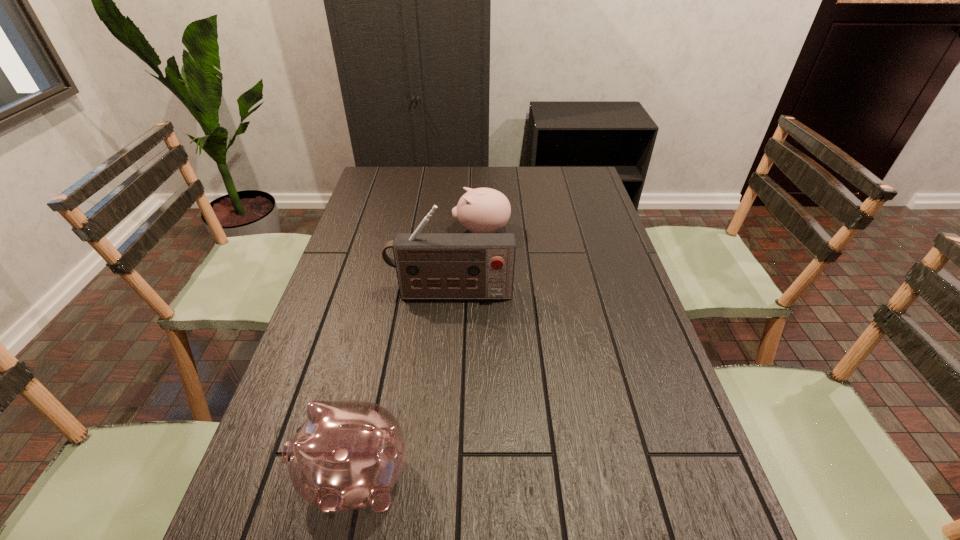
Identify the location of vacant point located between the second shortest object and the radio receiver. (403, 386).

Where is `free area in between the farther piggy bank and the nearest object`? The image size is (960, 540). free area in between the farther piggy bank and the nearest object is located at coordinates (419, 354).

Where is `vacant area that lies between the shorter piggy bank and the left piggy bank`? This screenshot has width=960, height=540. vacant area that lies between the shorter piggy bank and the left piggy bank is located at coordinates (419, 354).

The height and width of the screenshot is (540, 960). In order to click on vacant point located between the radio receiver and the taller piggy bank in this screenshot , I will do `click(403, 386)`.

I want to click on vacant area that lies between the nearer piggy bank and the second farthest object, so click(403, 386).

Where is `the closest object to the nearer piggy bank`? This screenshot has height=540, width=960. the closest object to the nearer piggy bank is located at coordinates (429, 265).

Identify which object is located as the nearest to the taller piggy bank. Please provide its 2D coordinates. Your answer should be formatted as a tuple, i.e. [(x, y)], where the tuple contains the x and y coordinates of a point satisfying the conditions above.

[(429, 265)]

I want to click on free spot that satisfies the following two spatial constraints: 1. on the front panel of the tallest object; 2. on the front facing side of the left piggy bank, so click(438, 477).

The width and height of the screenshot is (960, 540). Find the location of `vacant area that satisfies the following two spatial constraints: 1. on the front panel of the second farthest object; 2. on the front facing side of the nearest object`. vacant area that satisfies the following two spatial constraints: 1. on the front panel of the second farthest object; 2. on the front facing side of the nearest object is located at coordinates (438, 477).

Where is `vacant position in the image that satisfies the following two spatial constraints: 1. at the snout of the shorter piggy bank; 2. on the front panel of the tallest object`? Image resolution: width=960 pixels, height=540 pixels. vacant position in the image that satisfies the following two spatial constraints: 1. at the snout of the shorter piggy bank; 2. on the front panel of the tallest object is located at coordinates (482, 294).